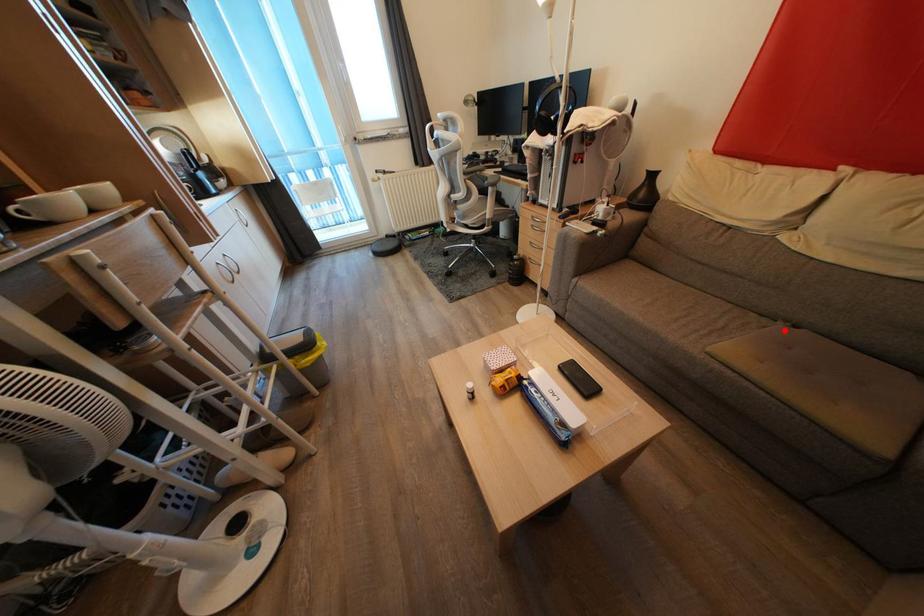
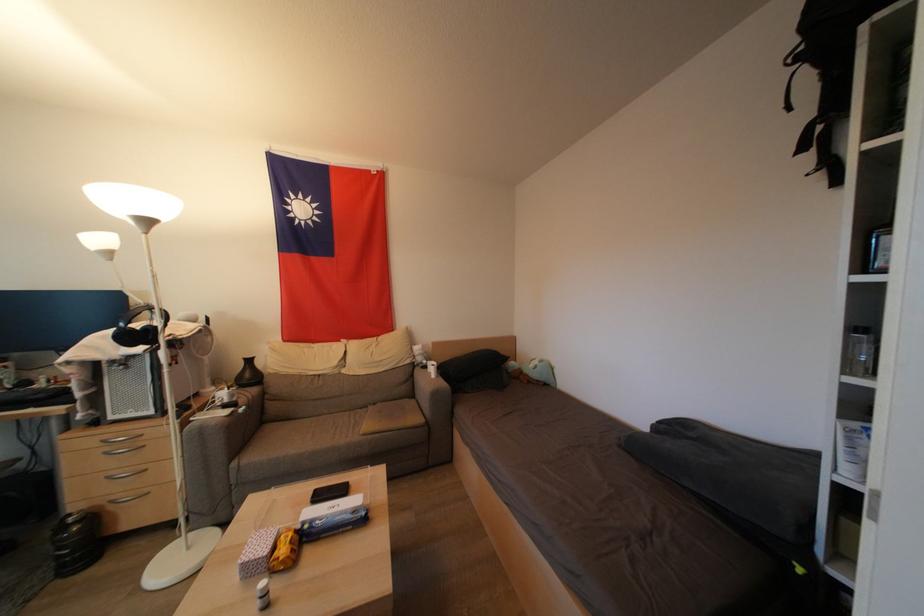
Question: I am providing you with two images of the same scene from different viewpoints. Given a red point in image1, look at the same physical point in image2. Is it:

Choices:
 (A) Closer to the viewpoint
 (B) Farther from the viewpoint

Answer: (B)